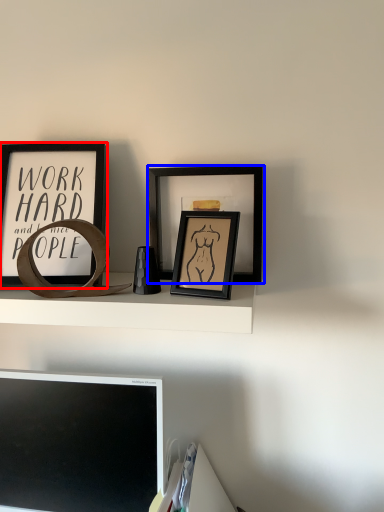
Question: Which point is further to the camera, picture frame (highlighted by a red box) or picture frame (highlighted by a blue box)?

Choices:
 (A) picture frame
 (B) picture frame

Answer: (B)